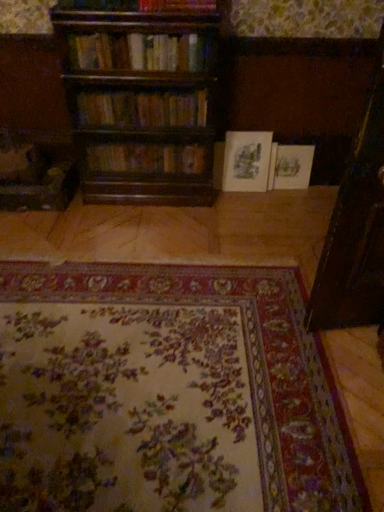
Image resolution: width=384 pixels, height=512 pixels. In order to click on vacant space to the left of matte paper book at center, arranged as the second book when viewed from the back in this screenshot , I will do `click(225, 195)`.